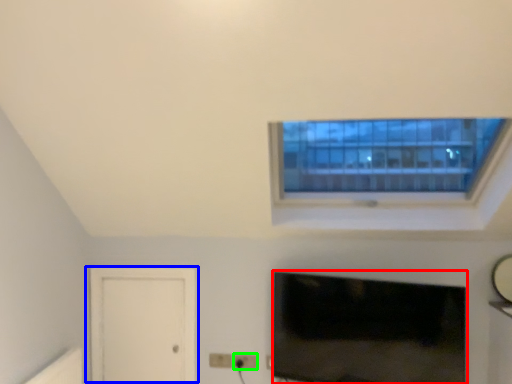
Question: Which is farther away from television (highlighted by a red box)? door (highlighted by a blue box) or electric outlet (highlighted by a green box)?

Choices:
 (A) door
 (B) electric outlet

Answer: (A)